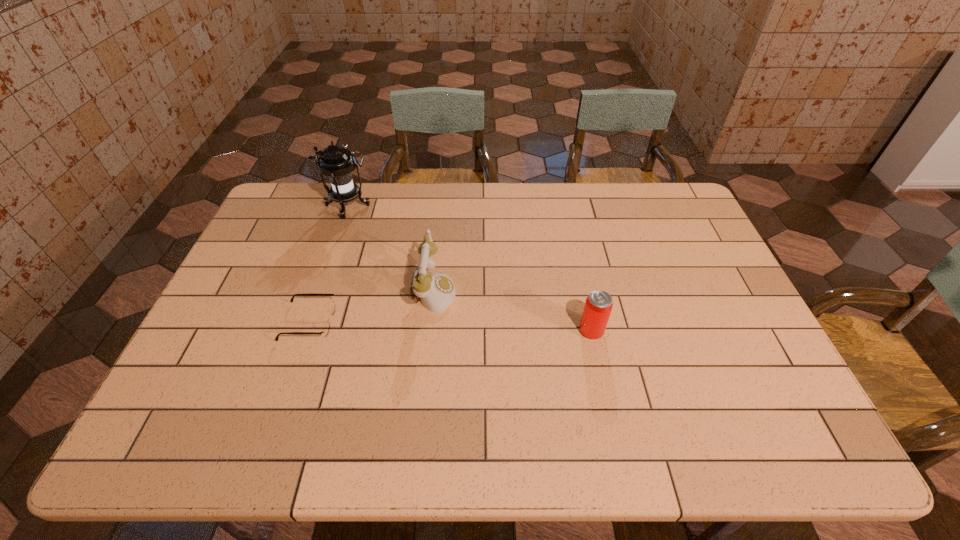
This screenshot has height=540, width=960. I want to click on the farthest object, so click(336, 162).

Identify the location of the tallest object. The image size is (960, 540). click(336, 162).

Image resolution: width=960 pixels, height=540 pixels. I want to click on the second object from right to left, so click(x=436, y=291).

Where is `the third shortest object`? The height and width of the screenshot is (540, 960). the third shortest object is located at coordinates (436, 291).

At what (x,y) coordinates should I click in order to perform the action: click on the second shortest object. Please return your answer as a coordinate pair (x, y). Looking at the image, I should click on (598, 305).

At what (x,y) coordinates should I click in order to perform the action: click on the rightmost object. Please return your answer as a coordinate pair (x, y). The image size is (960, 540). Looking at the image, I should click on (598, 305).

Identify the location of the shortest object. The width and height of the screenshot is (960, 540). (326, 329).

Locate an element on the screen. Image resolution: width=960 pixels, height=540 pixels. vacant area located 0.200m on the right of the farthest object is located at coordinates (428, 206).

Find the location of a particular element. free space located 0.100m on the dial of the third object from left to right is located at coordinates (491, 291).

The width and height of the screenshot is (960, 540). I want to click on free space located 0.240m on the right of the can, so click(693, 330).